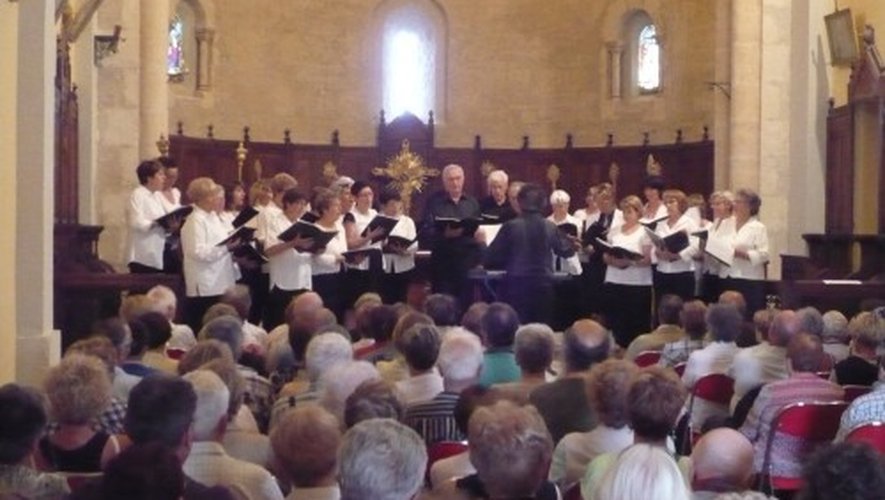
The height and width of the screenshot is (500, 885). Identify the location of backrest of folding chair. (790, 421), (859, 442), (720, 398), (643, 361), (442, 449).